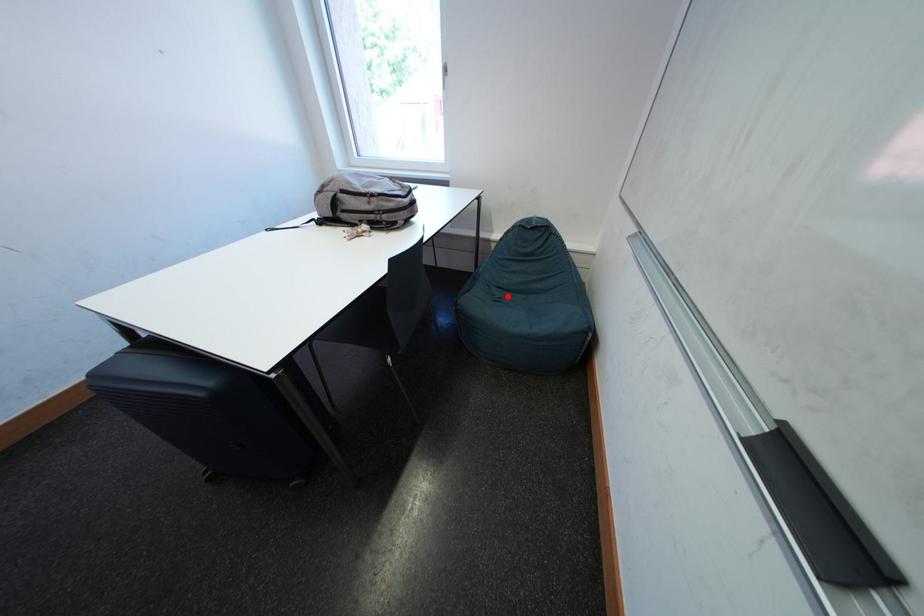
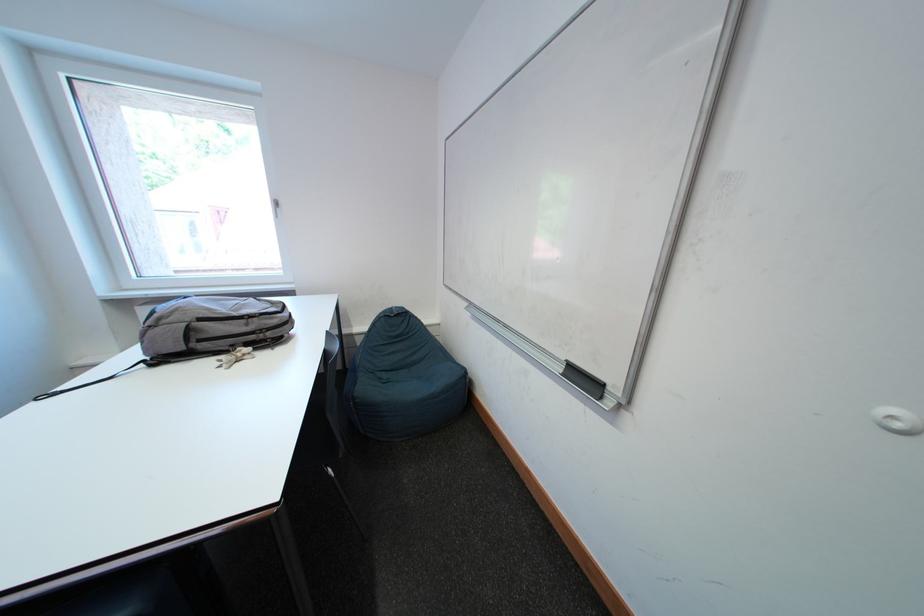
Question: I am providing you with two images of the same scene from different viewpoints. A red point is marked on the first image. Is the red point's position out of view in image 2?

Choices:
 (A) Yes
 (B) No

Answer: (B)